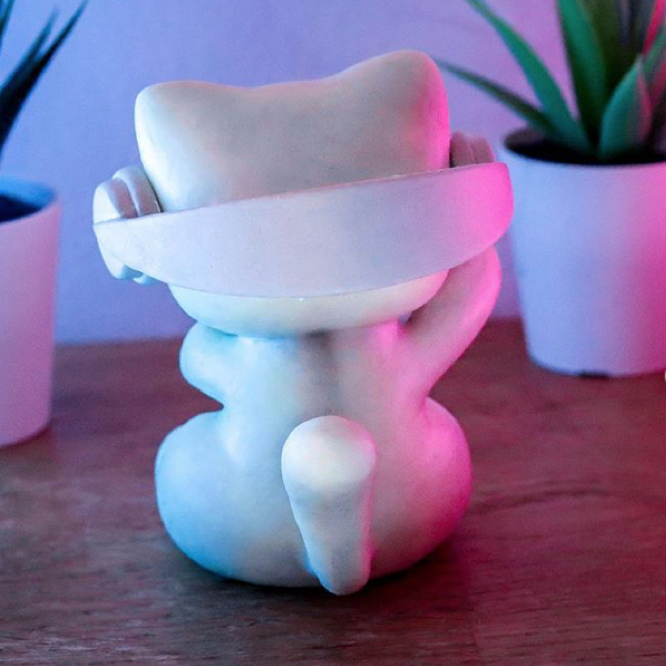
The height and width of the screenshot is (666, 666). What are the coordinates of `pots` in the screenshot? It's located at (38, 278), (579, 252).